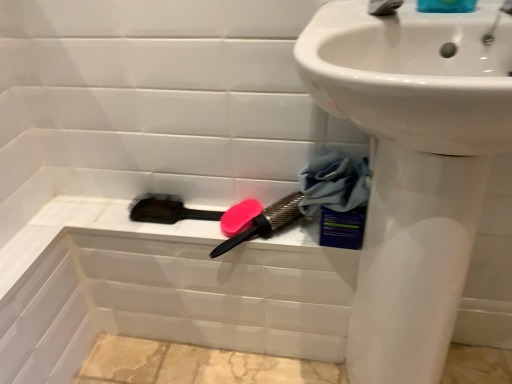
Where is `vacant position to the left of black bristle brush at lower center, which ranks as the 1th brush in left-to-right order`? The height and width of the screenshot is (384, 512). vacant position to the left of black bristle brush at lower center, which ranks as the 1th brush in left-to-right order is located at coordinates (106, 210).